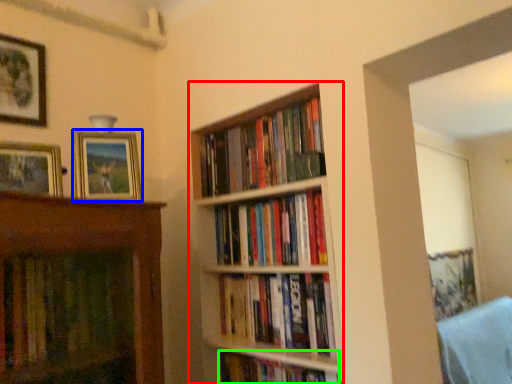
Question: Based on their relative distances, which object is nearer to shelf (highlighted by a red box)? Choose from picture frame (highlighted by a blue box) and book (highlighted by a green box).

Choices:
 (A) picture frame
 (B) book

Answer: (B)